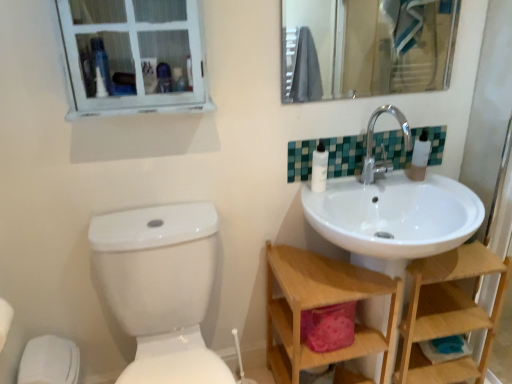
Find the location of a particular element. This screenshot has width=512, height=384. free space to the left of chrome metallic faucet at upper right is located at coordinates (344, 189).